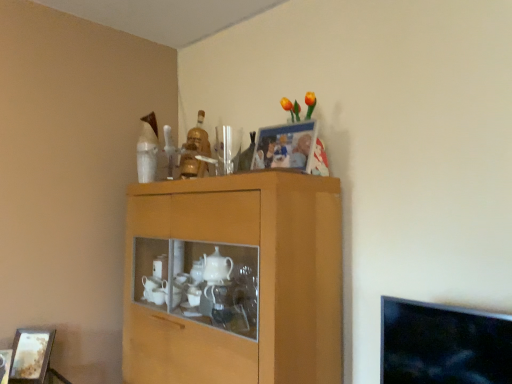
Locate an element on the screen. The height and width of the screenshot is (384, 512). wooden picture frame at lower left, which is counted as the first picture frame, starting from the back is located at coordinates (31, 356).

Considering the sizes of objects wooden cabinet at center and wooden picture frame at lower left, which is counted as the first picture frame, starting from the back, in the image provided, who is taller, wooden cabinet at center or wooden picture frame at lower left, which is counted as the first picture frame, starting from the back,?

wooden cabinet at center.

Which object is closer to the camera taking this photo, wooden cabinet at center or wooden picture frame at lower left, arranged as the second picture frame when viewed from the top?

wooden cabinet at center is in front.

Is wooden cabinet at center far away from wooden picture frame at lower left, the 1th picture frame viewed from the left?

wooden cabinet at center is near wooden picture frame at lower left, the 1th picture frame viewed from the left, not far away.

In the scene shown: Could you measure the distance between wooden cabinet at center and wooden picture frame at lower left, the 1th picture frame viewed from the left?

33.36 inches.

Is wooden picture frame at lower left, arranged as the second picture frame when viewed from the top, at the right side of wooden cabinet at center?

No.

In the image, is wooden picture frame at lower left, arranged as the second picture frame when viewed from the top, positioned in front of or behind wooden cabinet at center?

wooden picture frame at lower left, arranged as the second picture frame when viewed from the top, is behind wooden cabinet at center.

Is wooden picture frame at lower left, the 2th picture frame from the front, aimed at wooden cabinet at center?

No, wooden picture frame at lower left, the 2th picture frame from the front, does not turn towards wooden cabinet at center.

Are wooden picture frame at lower left, the 2th picture frame from the front, and wooden cabinet at center beside each other?

wooden picture frame at lower left, the 2th picture frame from the front, and wooden cabinet at center are not in contact.

Based on the photo, which is closer, (262, 139) or (218, 322)?

Point (262, 139) is farther from the camera than point (218, 322).

Is matte plastic picture frame at upper center, placed as the 2th picture frame when sorted from bottom to top, at the right side of wooden cabinet at center?

Correct, you'll find matte plastic picture frame at upper center, placed as the 2th picture frame when sorted from bottom to top, to the right of wooden cabinet at center.

How many degrees apart are the facing directions of matte plastic picture frame at upper center, the 1th picture frame positioned from the right, and wooden cabinet at center?

1.28 degrees separate the facing orientations of matte plastic picture frame at upper center, the 1th picture frame positioned from the right, and wooden cabinet at center.

Would you consider wooden picture frame at lower left, the 1th picture frame viewed from the left, to be distant from matte plastic picture frame at upper center, arranged as the second picture frame when viewed from the left?

Yes, wooden picture frame at lower left, the 1th picture frame viewed from the left, is far from matte plastic picture frame at upper center, arranged as the second picture frame when viewed from the left.

Can you confirm if wooden picture frame at lower left, which is counted as the first picture frame, starting from the back, is positioned to the right of matte plastic picture frame at upper center, the 1th picture frame viewed from the front?

No.

Locate an element on the screen. The height and width of the screenshot is (384, 512). picture frame above the wooden picture frame at lower left, which appears as the second picture frame when viewed from the right (from the image's perspective) is located at coordinates (285, 146).

From a real-world perspective, which object stands above the other?

matte plastic picture frame at upper center, the first picture frame viewed from the top.

Considering their positions, is matte plastic picture frame at upper center, the first picture frame viewed from the top, located in front of or behind wooden picture frame at lower left, arranged as the second picture frame when viewed from the top?

matte plastic picture frame at upper center, the first picture frame viewed from the top, is in front of wooden picture frame at lower left, arranged as the second picture frame when viewed from the top.

Looking at this image, from a real-world perspective, is matte plastic picture frame at upper center, the 1th picture frame positioned from the right, physically above wooden picture frame at lower left, the 1th picture frame viewed from the left?

Yes, from a real-world perspective, matte plastic picture frame at upper center, the 1th picture frame positioned from the right, is on top of wooden picture frame at lower left, the 1th picture frame viewed from the left.

Is point (302, 161) behind point (37, 383)?

No, (302, 161) is closer to viewer.

Is matte plastic picture frame at upper center, the 1th picture frame positioned from the right, bigger or smaller than wooden picture frame at lower left, which is counted as the first picture frame, starting from the back?

In the image, matte plastic picture frame at upper center, the 1th picture frame positioned from the right, appears to be larger than wooden picture frame at lower left, which is counted as the first picture frame, starting from the back.

Consider the image. Is wooden cabinet at center aimed at matte plastic picture frame at upper center, the first picture frame viewed from the top?

No, wooden cabinet at center is not oriented towards matte plastic picture frame at upper center, the first picture frame viewed from the top.

What's the angular difference between wooden cabinet at center and matte plastic picture frame at upper center, arranged as the second picture frame when viewed from the left,'s facing directions?

The angular difference between wooden cabinet at center and matte plastic picture frame at upper center, arranged as the second picture frame when viewed from the left, is 1.28 degrees.

Does point (320, 316) come closer to viewer compared to point (266, 167)?

That is True.

Considering the sizes of objects wooden cabinet at center and matte plastic picture frame at upper center, arranged as the second picture frame when viewed from the left, in the image provided, who is thinner, wooden cabinet at center or matte plastic picture frame at upper center, arranged as the second picture frame when viewed from the left,?

With smaller width is matte plastic picture frame at upper center, arranged as the second picture frame when viewed from the left.

What are the coordinates of `picture frame that is under the wooden cabinet at center (from a real-world perspective)` in the screenshot? It's located at click(31, 356).

You are a GUI agent. You are given a task and a screenshot of the screen. Output one action in this format:
    pyautogui.click(x=<x>, y=<y>)
    Task: Click on the cabinetry above the wooden picture frame at lower left, which is counted as the first picture frame, starting from the back (from the image's perspective)
    
    Given the screenshot: What is the action you would take?
    [x=234, y=280]

Considering their positions, is matte plastic picture frame at upper center, arranged as the second picture frame when viewed from the left, positioned closer to wooden picture frame at lower left, which appears as the second picture frame when viewed from the right, than wooden cabinet at center?

wooden cabinet at center lies closer to wooden picture frame at lower left, which appears as the second picture frame when viewed from the right, than the other object.

When comparing their distances from wooden cabinet at center, does wooden picture frame at lower left, arranged as the 1th picture frame when ordered from the bottom, or matte plastic picture frame at upper center, placed as the 2th picture frame when sorted from bottom to top, seem closer?

matte plastic picture frame at upper center, placed as the 2th picture frame when sorted from bottom to top.

Estimate the real-world distances between objects in this image. Which object is closer to wooden cabinet at center, matte plastic picture frame at upper center, which ranks as the 2th picture frame in back-to-front order, or wooden picture frame at lower left, the 1th picture frame viewed from the left?

The object closer to wooden cabinet at center is matte plastic picture frame at upper center, which ranks as the 2th picture frame in back-to-front order.

From the image, which object appears to be nearer to matte plastic picture frame at upper center, the first picture frame viewed from the top, wooden picture frame at lower left, which appears as the second picture frame when viewed from the right, or wooden cabinet at center?

wooden cabinet at center is positioned closer to the anchor matte plastic picture frame at upper center, the first picture frame viewed from the top.

Which object lies further to the anchor point matte plastic picture frame at upper center, which ranks as the 2th picture frame in back-to-front order, wooden cabinet at center or wooden picture frame at lower left, which appears as the second picture frame when viewed from the right?

Among the two, wooden picture frame at lower left, which appears as the second picture frame when viewed from the right, is located further to matte plastic picture frame at upper center, which ranks as the 2th picture frame in back-to-front order.

Looking at the image, which one is located further to wooden picture frame at lower left, arranged as the second picture frame when viewed from the top, wooden cabinet at center or matte plastic picture frame at upper center, the 1th picture frame positioned from the right?

The object further to wooden picture frame at lower left, arranged as the second picture frame when viewed from the top, is matte plastic picture frame at upper center, the 1th picture frame positioned from the right.

Locate an element on the screen. cabinetry situated between wooden picture frame at lower left, arranged as the 1th picture frame when ordered from the bottom, and matte plastic picture frame at upper center, arranged as the second picture frame when viewed from the left, from left to right is located at coordinates (234, 280).